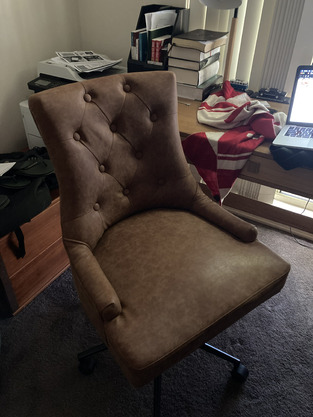
Identify the location of laptop. This screenshot has height=417, width=313. (302, 94).